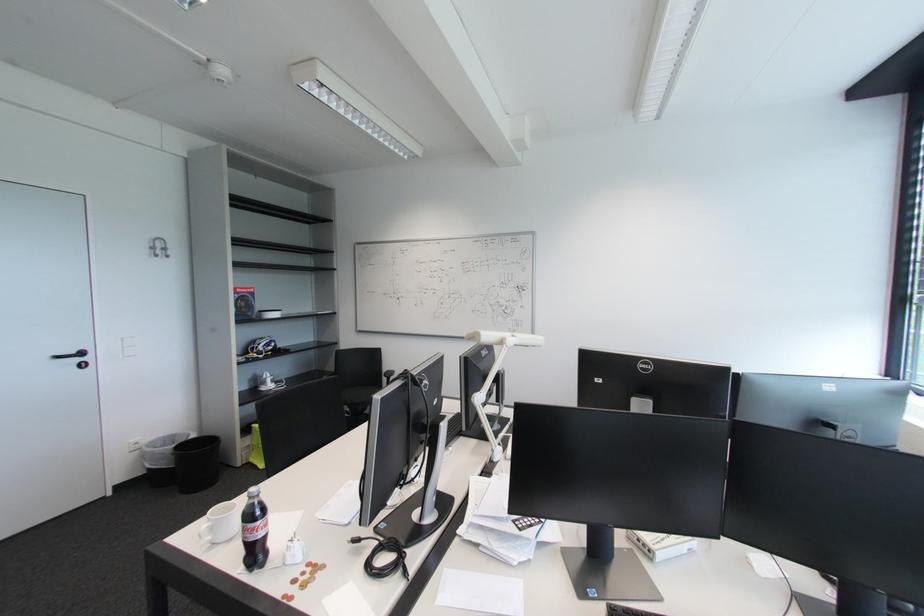
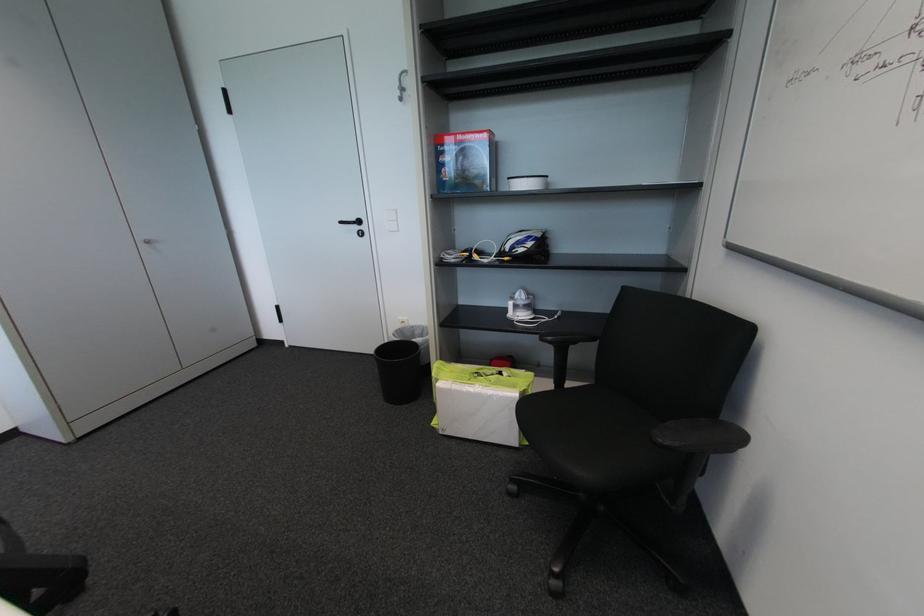
Where in the second image is the point corresponding to point (246, 292) from the first image?

(466, 139)